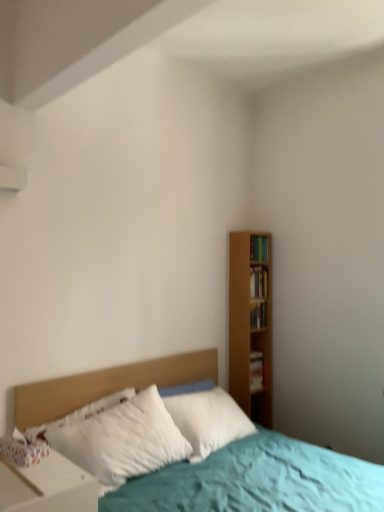
Image resolution: width=384 pixels, height=512 pixels. Describe the element at coordinates (258, 315) in the screenshot. I see `wooden bookshelf at right, which is the second book from bottom to top` at that location.

I want to click on wooden bookshelf at right, which is the fourth book from bottom to top, so click(259, 248).

Locate an element on the screen. wooden bookshelf at right, the 2th book viewed from the top is located at coordinates (258, 282).

From a real-world perspective, is wooden bookshelf at right, which is the second book from bottom to top, located beneath hardcover book at right, which is counted as the first book, starting from the bottom?

No, from a real-world perspective, wooden bookshelf at right, which is the second book from bottom to top, is not under hardcover book at right, which is counted as the first book, starting from the bottom.

At what (x,y) coordinates should I click in order to perform the action: click on book that is the 1st object located above the hardcover book at right, the fourth book when ordered from top to bottom (from the image's perspective). Please return your answer as a coordinate pair (x, y). This screenshot has width=384, height=512. Looking at the image, I should click on (258, 315).

Can you confirm if wooden bookshelf at right, arranged as the 3th book when viewed from the top, is positioned to the left of hardcover book at right, the fourth book when ordered from top to bottom?

Correct, you'll find wooden bookshelf at right, arranged as the 3th book when viewed from the top, to the left of hardcover book at right, the fourth book when ordered from top to bottom.

Consider the image. How different are the orientations of white glossy nightstand at lower left and wooden bookshelf at right, the third book when ordered from bottom to top, in degrees?

There is a 92.8-degree angle between the facing directions of white glossy nightstand at lower left and wooden bookshelf at right, the third book when ordered from bottom to top.

Which object is closer to the camera taking this photo, white glossy nightstand at lower left or wooden bookshelf at right, the third book when ordered from bottom to top?

white glossy nightstand at lower left.

Is white glossy nightstand at lower left positioned far away from wooden bookshelf at right, the 2th book viewed from the top?

Indeed, white glossy nightstand at lower left is not near wooden bookshelf at right, the 2th book viewed from the top.

Is wooden bookshelf at right, the 1th book in the top-to-bottom sequence, surrounded by hardcover book at right, the fourth book when ordered from top to bottom?

No, wooden bookshelf at right, the 1th book in the top-to-bottom sequence, is located outside of hardcover book at right, the fourth book when ordered from top to bottom.

From the image's perspective, would you say hardcover book at right, which is counted as the first book, starting from the bottom, is positioned over wooden bookshelf at right, the 1th book in the top-to-bottom sequence?

No, from the image's perspective, hardcover book at right, which is counted as the first book, starting from the bottom, is not above wooden bookshelf at right, the 1th book in the top-to-bottom sequence.

From a real-world perspective, who is located higher, hardcover book at right, the fourth book when ordered from top to bottom, or wooden bookshelf at right, the 1th book in the top-to-bottom sequence?

In real-world perspective, wooden bookshelf at right, the 1th book in the top-to-bottom sequence, is above.

Who is taller, hardcover book at right, the fourth book when ordered from top to bottom, or wooden bookshelf at right, the 1th book in the top-to-bottom sequence?

wooden bookshelf at right, the 1th book in the top-to-bottom sequence, is taller.

Is wooden bookshelf at right, the third book when ordered from bottom to top, with wooden bookshelf at right, which is the fourth book from bottom to top?

No, wooden bookshelf at right, the third book when ordered from bottom to top, is not making contact with wooden bookshelf at right, which is the fourth book from bottom to top.

Would you say wooden bookshelf at right, the 2th book viewed from the top, is to the left or to the right of wooden bookshelf at right, which is the fourth book from bottom to top, in the picture?

From the image, it's evident that wooden bookshelf at right, the 2th book viewed from the top, is to the left of wooden bookshelf at right, which is the fourth book from bottom to top.

Is wooden bookshelf at right, the 2th book viewed from the top, oriented away from wooden bookshelf at right, the 1th book in the top-to-bottom sequence?

No, wooden bookshelf at right, the 2th book viewed from the top,'s orientation is not away from wooden bookshelf at right, the 1th book in the top-to-bottom sequence.

From the image's perspective, which one is positioned higher, wooden bookshelf at right, the third book when ordered from bottom to top, or wooden bookshelf at right, which is the fourth book from bottom to top?

From the image's view, wooden bookshelf at right, which is the fourth book from bottom to top, is above.

Looking at the image, does hardcover book at right, which is counted as the first book, starting from the bottom, seem bigger or smaller compared to white soft pillow at center?

hardcover book at right, which is counted as the first book, starting from the bottom, is smaller than white soft pillow at center.

Identify the location of the 1st book positioned above the white soft pillow at center (from the image's perspective). This screenshot has height=512, width=384. (257, 371).

Is hardcover book at right, which is counted as the first book, starting from the bottom, touching white soft pillow at center?

hardcover book at right, which is counted as the first book, starting from the bottom, is not next to white soft pillow at center, and they're not touching.

Which is closer, (253, 377) or (125, 473)?

The point (125, 473) is closer.

Considering the positions of points (259, 297) and (86, 507), is point (259, 297) closer to camera compared to point (86, 507)?

No, (259, 297) is further to viewer.

Between wooden bookshelf at right, the 2th book viewed from the top, and white glossy nightstand at lower left, which one appears on the left side from the viewer's perspective?

From the viewer's perspective, white glossy nightstand at lower left appears more on the left side.

Is wooden bookshelf at right, the 2th book viewed from the top, in front of or behind white glossy nightstand at lower left in the image?

wooden bookshelf at right, the 2th book viewed from the top, is behind white glossy nightstand at lower left.

Who is bigger, wooden bookshelf at right, the 2th book viewed from the top, or white glossy nightstand at lower left?

Bigger between the two is white glossy nightstand at lower left.

Which of these two, wooden bookshelf at right, which is the fourth book from bottom to top, or white glossy nightstand at lower left, is thinner?

Thinner between the two is wooden bookshelf at right, which is the fourth book from bottom to top.

Is there a large distance between wooden bookshelf at right, which is the fourth book from bottom to top, and white glossy nightstand at lower left?

wooden bookshelf at right, which is the fourth book from bottom to top, is far away from white glossy nightstand at lower left.

From the image's perspective, between wooden bookshelf at right, the 1th book in the top-to-bottom sequence, and white glossy nightstand at lower left, which one is located above?

From the image's view, wooden bookshelf at right, the 1th book in the top-to-bottom sequence, is above.

You are a GUI agent. You are given a task and a screenshot of the screen. Output one action in this format:
    pyautogui.click(x=<x>, y=<y>)
    Task: Click on the 3rd book behind the wooden bookshelf at right, which is the second book from bottom to top, starting your count from the anchor
    This screenshot has width=384, height=512.
    Given the screenshot: What is the action you would take?
    pyautogui.click(x=257, y=371)

The image size is (384, 512). Identify the location of nightstand that is under the wooden bookshelf at right, the third book when ordered from bottom to top (from a real-world perspective). (47, 486).

Considering their positions, is white soft pillow at center positioned closer to hardcover book at right, which is counted as the first book, starting from the bottom, than wooden bookshelf at right, which is the second book from bottom to top?

Among the two, wooden bookshelf at right, which is the second book from bottom to top, is located nearer to hardcover book at right, which is counted as the first book, starting from the bottom.

When comparing their distances from white soft pillow at center, does hardcover book at right, which is counted as the first book, starting from the bottom, or wooden bookshelf at right, which is the fourth book from bottom to top, seem further?

The object further to white soft pillow at center is wooden bookshelf at right, which is the fourth book from bottom to top.

When comparing their distances from wooden bookshelf at right, which is the fourth book from bottom to top, does wooden bookshelf at right, arranged as the 3th book when viewed from the top, or wooden bookshelf at right, the 2th book viewed from the top, seem further?

wooden bookshelf at right, arranged as the 3th book when viewed from the top, is further to wooden bookshelf at right, which is the fourth book from bottom to top.

Looking at this image, considering their positions, is white soft pillow at center positioned closer to hardcover book at right, which is counted as the first book, starting from the bottom, than white glossy nightstand at lower left?

white soft pillow at center is positioned closer to the anchor hardcover book at right, which is counted as the first book, starting from the bottom.

When comparing their distances from white glossy nightstand at lower left, does wooden bookshelf at right, the 1th book in the top-to-bottom sequence, or wooden bookshelf at right, the 2th book viewed from the top, seem closer?

The object closer to white glossy nightstand at lower left is wooden bookshelf at right, the 2th book viewed from the top.

When comparing their distances from wooden bookshelf at right, which is the fourth book from bottom to top, does white glossy nightstand at lower left or wooden bookshelf at right, the third book when ordered from bottom to top, seem closer?

wooden bookshelf at right, the third book when ordered from bottom to top, lies closer to wooden bookshelf at right, which is the fourth book from bottom to top, than the other object.

From the image, which object appears to be farther from wooden bookshelf at right, the third book when ordered from bottom to top, white glossy nightstand at lower left or wooden bookshelf at right, the 1th book in the top-to-bottom sequence?

white glossy nightstand at lower left is further to wooden bookshelf at right, the third book when ordered from bottom to top.

When comparing their distances from hardcover book at right, which is counted as the first book, starting from the bottom, does wooden bookshelf at right, the 1th book in the top-to-bottom sequence, or wooden bookshelf at right, the third book when ordered from bottom to top, seem closer?

wooden bookshelf at right, the third book when ordered from bottom to top.

At what (x,y) coordinates should I click in order to perform the action: click on pillow located between white glossy nightstand at lower left and wooden bookshelf at right, the 1th book in the top-to-bottom sequence, in the depth direction. Please return your answer as a coordinate pair (x, y). The width and height of the screenshot is (384, 512). Looking at the image, I should click on (121, 438).

Where is `book between wooden bookshelf at right, which is the fourth book from bottom to top, and wooden bookshelf at right, arranged as the 3th book when viewed from the top, in the up-down direction`? The width and height of the screenshot is (384, 512). book between wooden bookshelf at right, which is the fourth book from bottom to top, and wooden bookshelf at right, arranged as the 3th book when viewed from the top, in the up-down direction is located at coordinates (258, 282).

This screenshot has height=512, width=384. In order to click on pillow positioned between white glossy nightstand at lower left and hardcover book at right, the fourth book when ordered from top to bottom, from near to far in this screenshot , I will do `click(121, 438)`.

Locate an element on the screen. This screenshot has width=384, height=512. book positioned between white glossy nightstand at lower left and wooden bookshelf at right, the third book when ordered from bottom to top, from near to far is located at coordinates (258, 315).